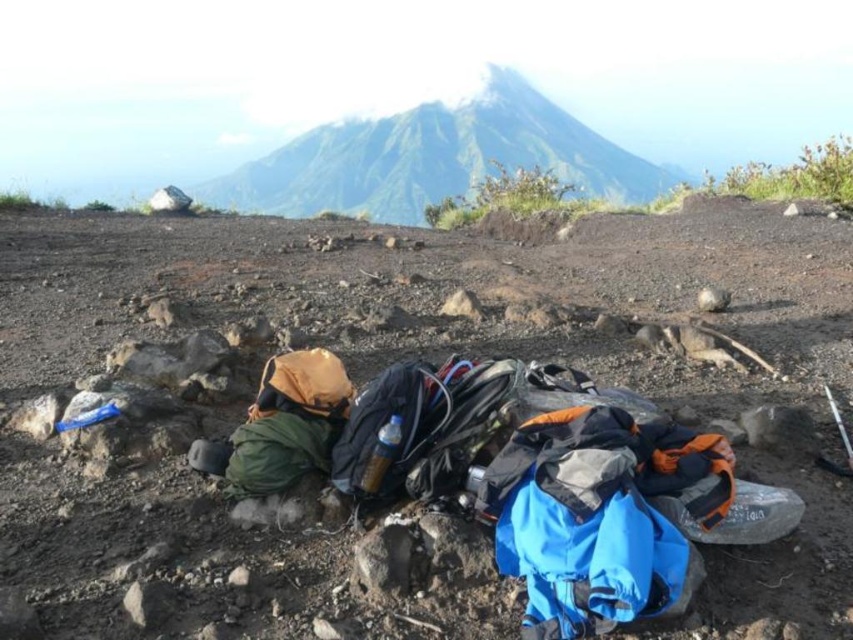
Question: Does dull gray rock at center appear over smooth gray mountain at upper center?

Choices:
 (A) no
 (B) yes

Answer: (A)

Question: Among these objects, which one is nearest to the camera?

Choices:
 (A) dull gray rock at center
 (B) smooth gray mountain at upper center

Answer: (A)

Question: Which point appears farthest from the camera in this image?

Choices:
 (A) (370, 176)
 (B) (294, 316)

Answer: (A)

Question: Can you confirm if dull gray rock at center is positioned below smooth gray mountain at upper center?

Choices:
 (A) yes
 (B) no

Answer: (A)

Question: Where is dull gray rock at center located in relation to smooth gray mountain at upper center in the image?

Choices:
 (A) right
 (B) left

Answer: (B)